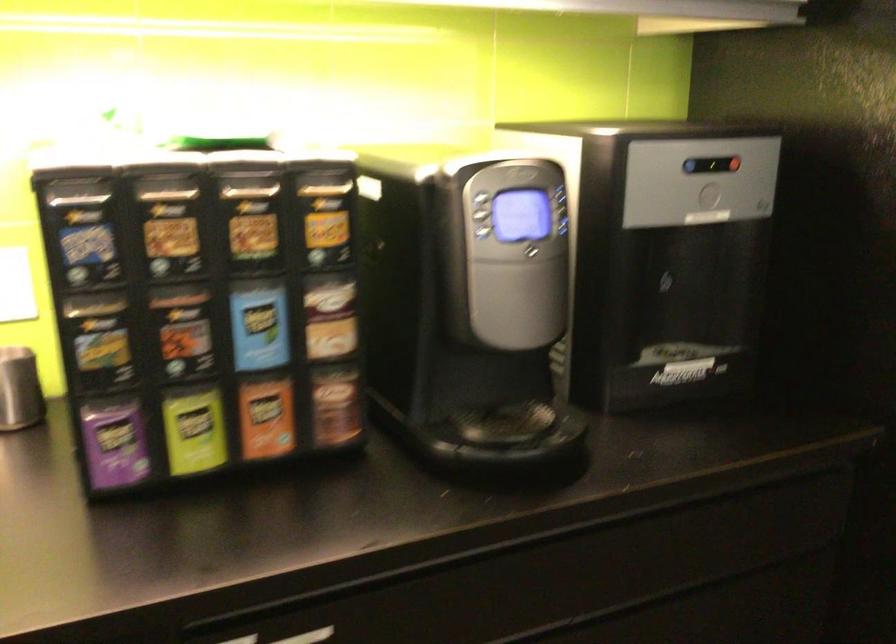
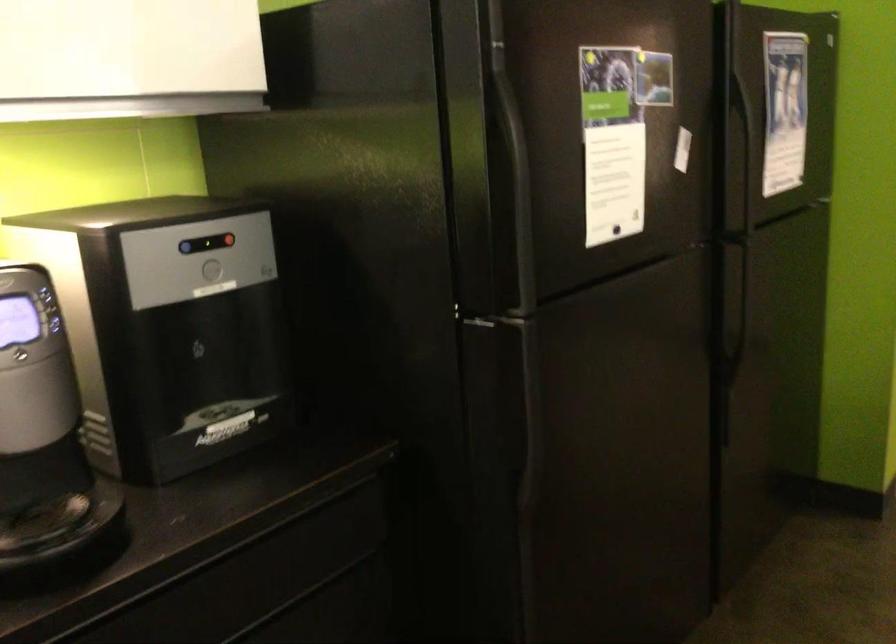
The images are taken continuously from a first-person perspective. In which direction are you moving?

The cameraman walked toward right, backward.